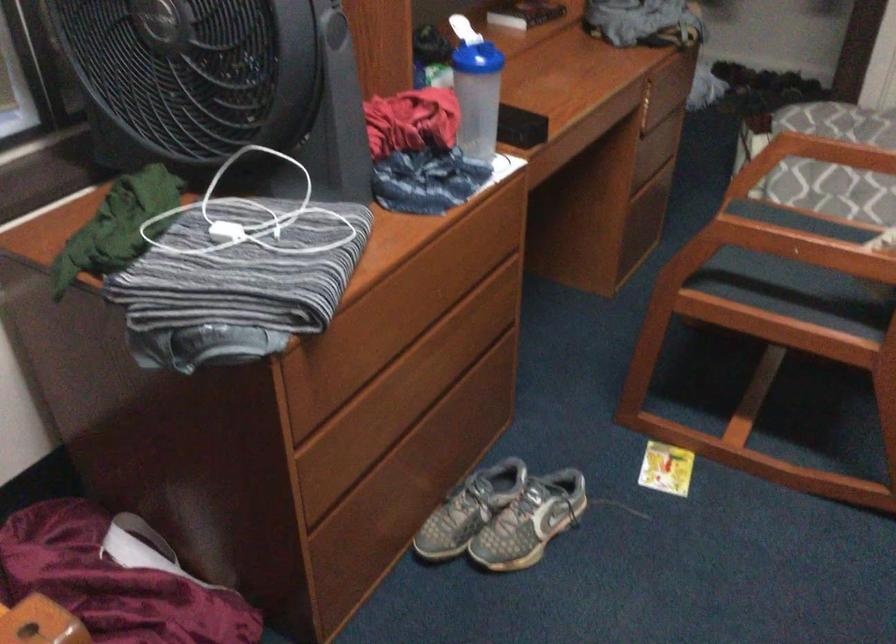
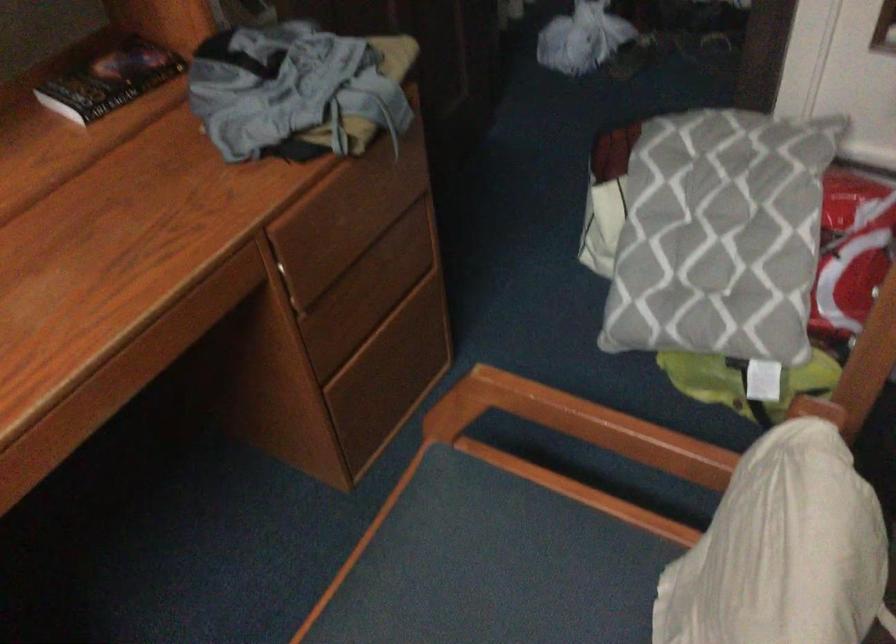
What movement of the cameraman would produce the second image?

The cameraman walked toward right, forward.